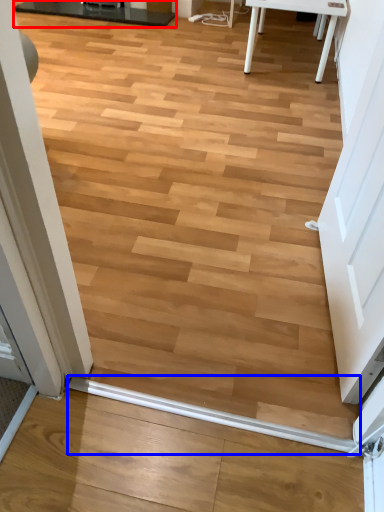
Question: Which object appears closest to the camera in this image, table (highlighted by a red box) or beam (highlighted by a blue box)?

Choices:
 (A) table
 (B) beam

Answer: (B)